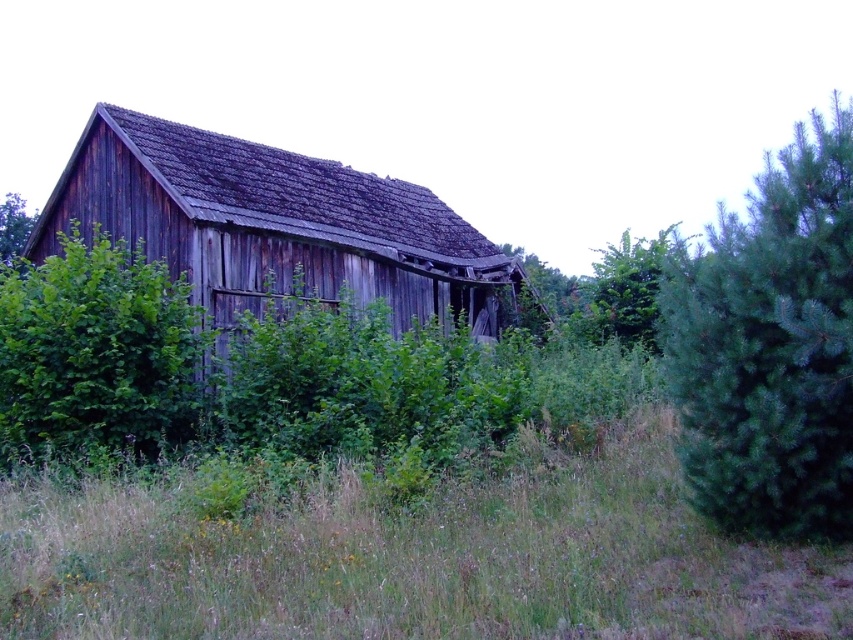
Question: Can you confirm if weathered wood hut at center is bigger than green leafy tree at center?

Choices:
 (A) yes
 (B) no

Answer: (B)

Question: Can you confirm if weathered wood hut at center is positioned below green leafy tree at upper left?

Choices:
 (A) no
 (B) yes

Answer: (B)

Question: Is green grass at center in front of green leafy tree at upper left?

Choices:
 (A) no
 (B) yes

Answer: (B)

Question: Which object is farther from the camera taking this photo?

Choices:
 (A) green leafy bush at left
 (B) green needle-like tree at right
 (C) weathered wood hut at center

Answer: (C)

Question: Which point is closer to the camera?

Choices:
 (A) green leafy bush at left
 (B) green needle-like tree at right
 (C) green leafy tree at upper left
 (D) weathered wood hut at center

Answer: (B)

Question: Which point appears closest to the camera in this image?

Choices:
 (A) (1, 550)
 (B) (111, 259)
 (C) (10, 216)

Answer: (A)